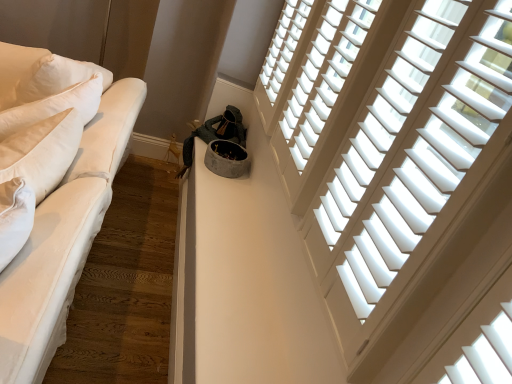
Question: Considering the positions of white wood blinds at upper right, the 2th window in the back-to-front sequence, and white cotton studio couch at left in the image, is white wood blinds at upper right, the 2th window in the back-to-front sequence, taller or shorter than white cotton studio couch at left?

Choices:
 (A) tall
 (B) short

Answer: (B)

Question: Is white wood blinds at upper right, the 2th window in the back-to-front sequence, inside or outside of white cotton studio couch at left?

Choices:
 (A) inside
 (B) outside

Answer: (B)

Question: Estimate the real-world distances between objects in this image. Which object is closer to the white wood blinds at upper right, arranged as the third window when viewed from the back?

Choices:
 (A) white cotton studio couch at left
 (B) white wood blinds at upper right, the third window in the front-to-back sequence
 (C) white wood blinds at upper right, placed as the second window when sorted from front to back

Answer: (C)

Question: Which object is positioned farthest from the white wood blinds at upper right, arranged as the third window when viewed from the back?

Choices:
 (A) white cotton studio couch at left
 (B) white wood blinds at upper right, the third window in the front-to-back sequence
 (C) white wood blinds at upper right, the 2th window in the back-to-front sequence

Answer: (B)